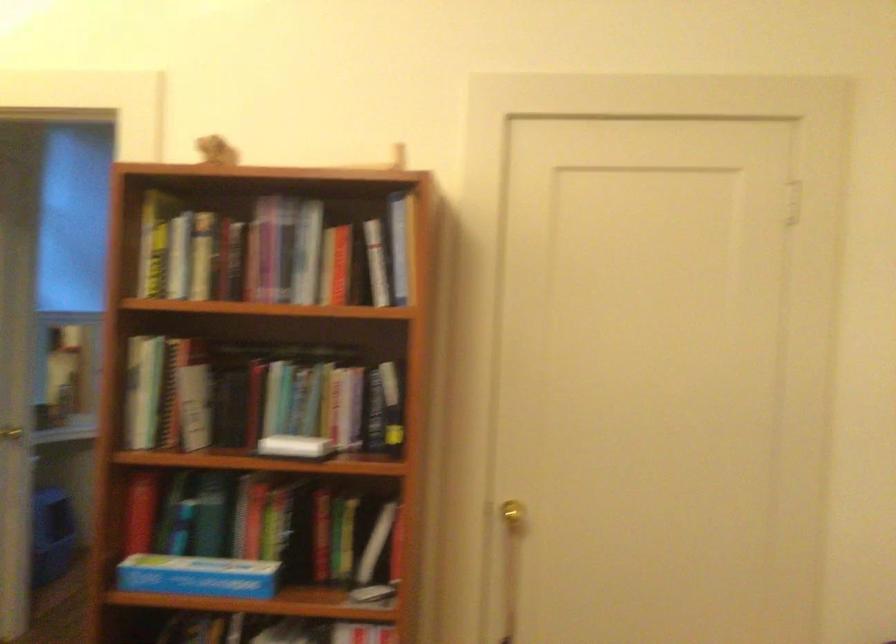
Describe the element at coordinates (513, 514) in the screenshot. I see `a gold door knob` at that location.